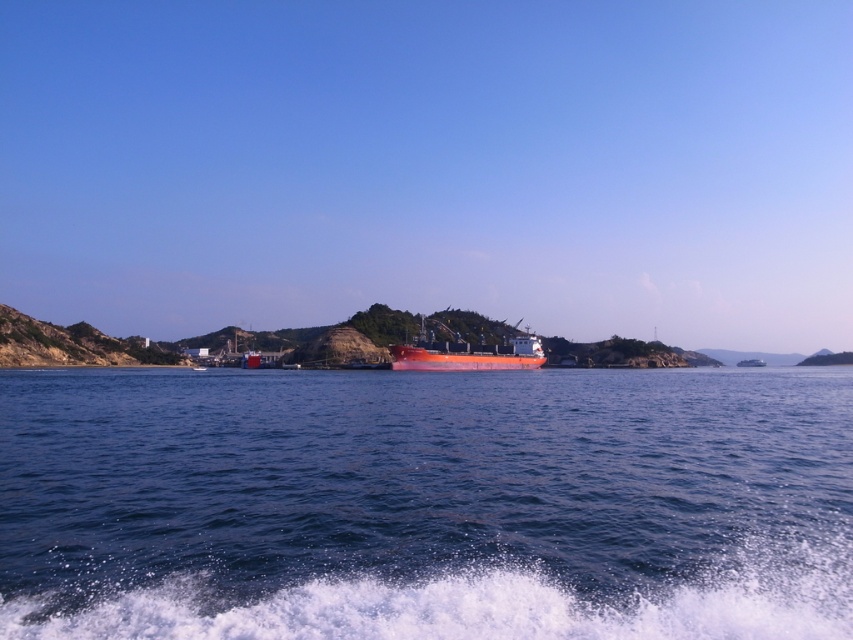
Is point (44, 612) farther from camera compared to point (451, 333)?

No.

Who is higher up, blue water at center or matte orange ship at center?

matte orange ship at center is higher up.

Find the location of a particular element. blue water at center is located at coordinates (425, 502).